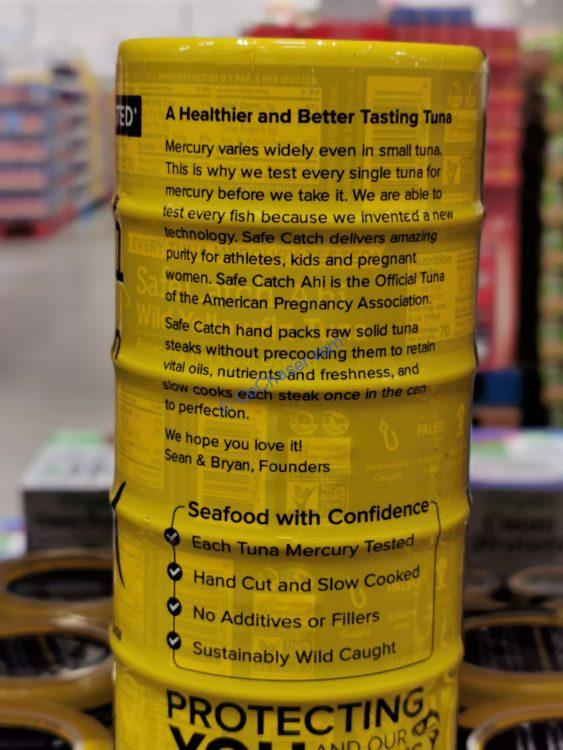
I want to click on back wall, so click(44, 26), click(120, 22), click(226, 18).